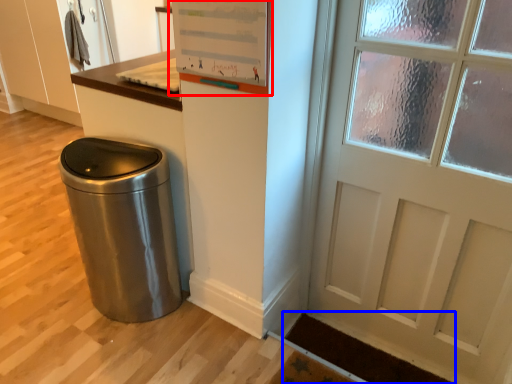
Question: Which point is closer to the camera, bulletin board (highlighted by a red box) or doormat (highlighted by a blue box)?

Choices:
 (A) bulletin board
 (B) doormat

Answer: (A)